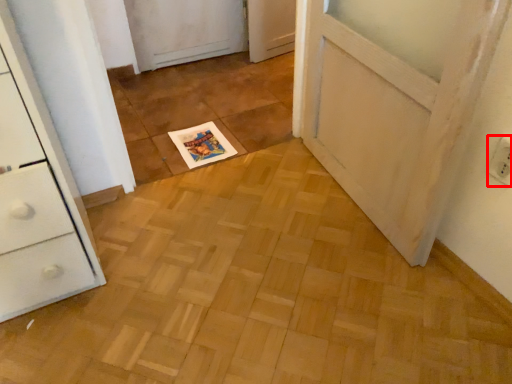
Question: From the image's perspective, where is electric outlet (annotated by the red box) located in relation to magazine in the image?

Choices:
 (A) above
 (B) below

Answer: (B)